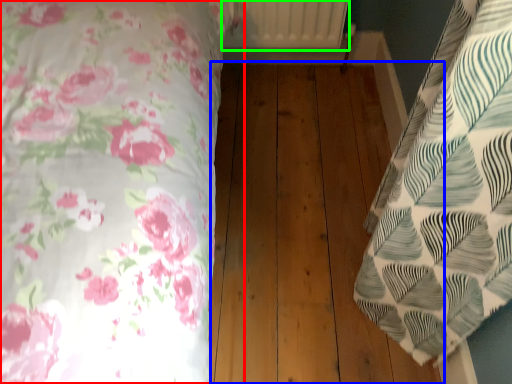
Question: Based on their relative distances, which object is farther from bed (highlighted by a red box)? Choose from hardwood (highlighted by a blue box) and radiator (highlighted by a green box).

Choices:
 (A) hardwood
 (B) radiator

Answer: (B)